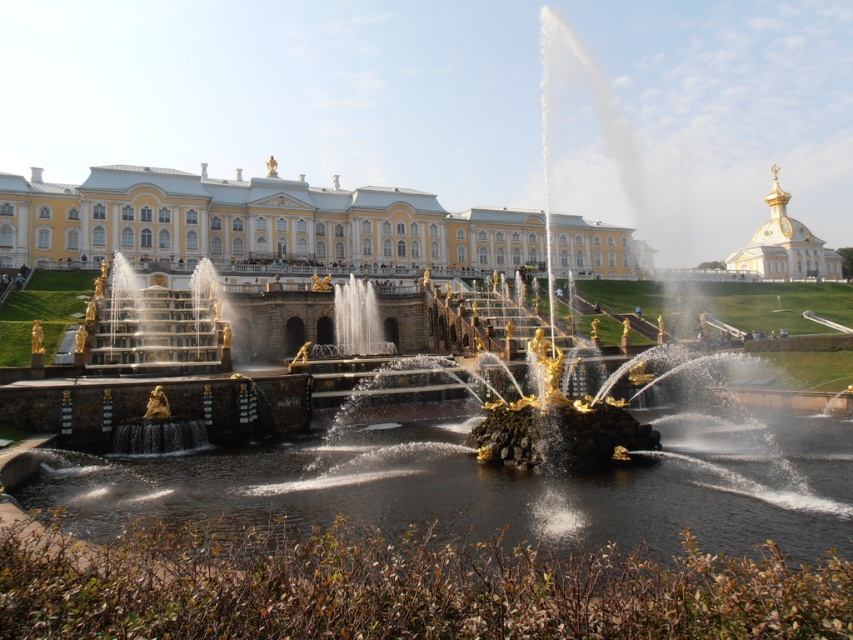
Based on the photo, you are standing in front of the fountain complex and want to locate two specific points marked in the image. Which of the two points, point (486, 496) or point (814, 268), is closer to you?

Point (486, 496) is closer to the viewer than point (814, 268).

Looking at this image, you are standing at the center of the grand fountain area in front of the palace. You want to locate the clear water at fountain center. Where exactly is it located?

The clear water at fountain center is located at point (492, 486).